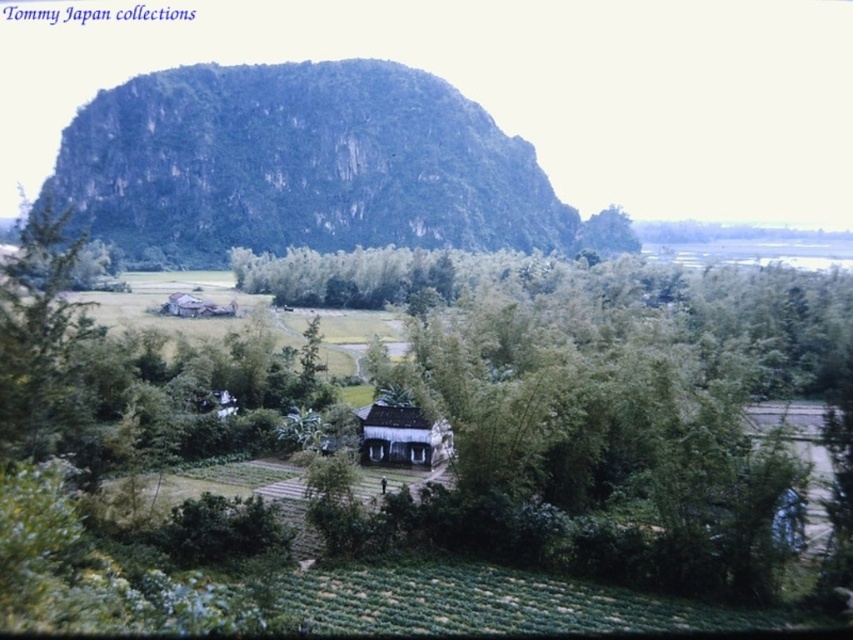
Is green rock at upper center shorter than wooden hut at center?

Incorrect, green rock at upper center's height does not fall short of wooden hut at center's.

Is green rock at upper center wider than wooden hut at center?

Indeed, green rock at upper center has a greater width compared to wooden hut at center.

At what (x,y) coordinates should I click in order to perform the action: click on green rock at upper center. Please return your answer as a coordinate pair (x, y). Looking at the image, I should click on (306, 166).

I want to click on green rock at upper center, so click(x=306, y=166).

Which of these two, white wood hut at center or wooden hut at center, stands taller?

wooden hut at center

What do you see at coordinates (401, 436) in the screenshot?
I see `white wood hut at center` at bounding box center [401, 436].

Which is behind, point (363, 422) or point (199, 305)?

The point (199, 305) is more distant.

The width and height of the screenshot is (853, 640). Identify the location of white wood hut at center. tap(401, 436).

Can you confirm if green leafy tree at left is wider than white wood hut at center?

Indeed, green leafy tree at left has a greater width compared to white wood hut at center.

Can you confirm if green leafy tree at left is smaller than white wood hut at center?

No, green leafy tree at left is not smaller than white wood hut at center.

Does point (62, 275) lie in front of point (428, 444)?

That is True.

This screenshot has width=853, height=640. Identify the location of green leafy tree at left. (38, 326).